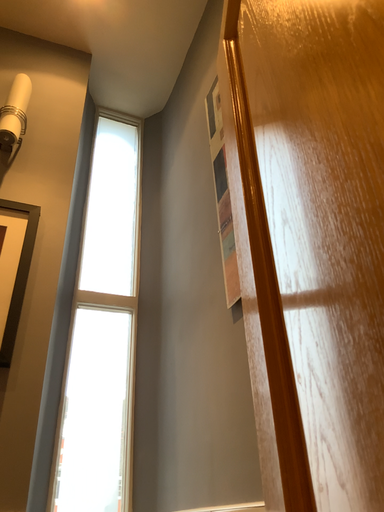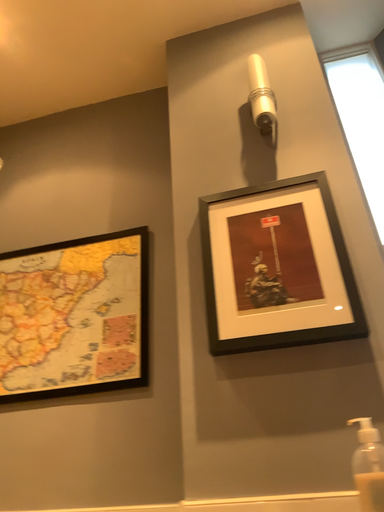
Question: Which way did the camera rotate in the video?

Choices:
 (A) rotated left
 (B) rotated right

Answer: (A)